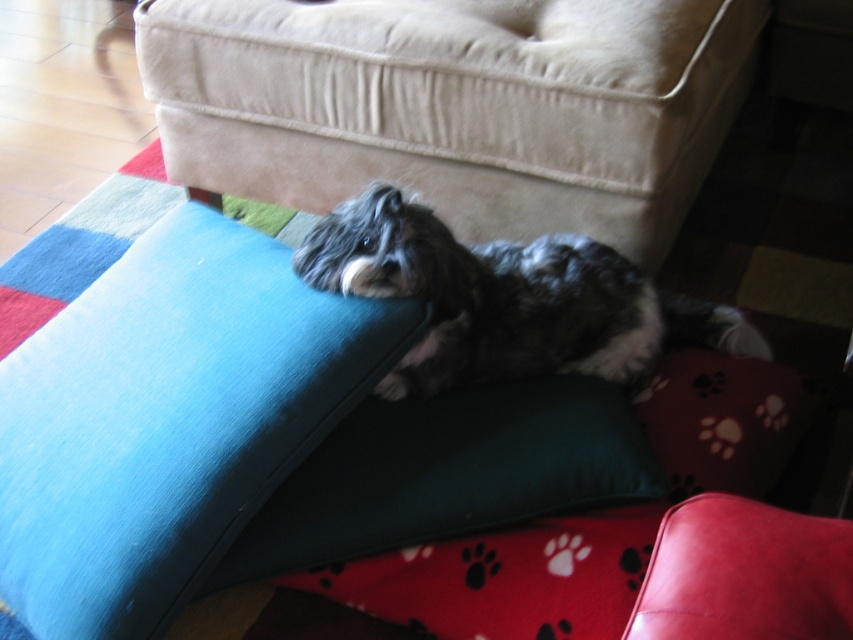
You are trying to decide which dog to adopt between the shaggy fur dog at center and the fluffy gray dog at center. Based on their sizes, which one might require a larger dog bed?

The shaggy fur dog at center might require a larger dog bed since it is wider than the fluffy gray dog at center according to the description.

You are a photographer trying to capture the shaggy fur dog at center in the image. The camera is positioned at the point with coordinates point [456,106]. Can you determine if the dog is facing towards or away from the camera?

The point [456,106] marks shaggy fur dog at center, so the camera is positioned exactly where the dog is located. Therefore, the dog is facing neither towards nor away from the camera since the camera is at the dog itself.